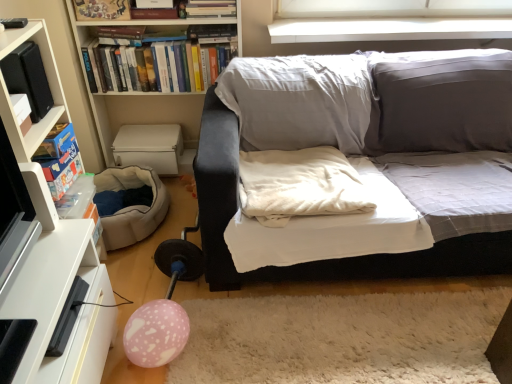
Question: Does white fabric couch at center appear on the left side of matte wooden frame at upper left, which is the 2th book from back to front?

Choices:
 (A) no
 (B) yes

Answer: (A)

Question: From the image's perspective, is white fabric couch at center located above matte wooden frame at upper left, which is the 2th book from back to front?

Choices:
 (A) yes
 (B) no

Answer: (B)

Question: Would you say white fabric couch at center is outside matte wooden frame at upper left, which is the first book in front-to-back order?

Choices:
 (A) yes
 (B) no

Answer: (A)

Question: Is white fabric couch at center oriented away from matte wooden frame at upper left, which is the 2th book from back to front?

Choices:
 (A) no
 (B) yes

Answer: (A)

Question: Does white fabric couch at center have a greater width compared to matte wooden frame at upper left, which is the 2th book from back to front?

Choices:
 (A) yes
 (B) no

Answer: (A)

Question: From a real-world perspective, is black matte speaker at left, the third paperback book in the bottom-to-top sequence, physically located above or below blue cardboard game box at left, marked as the 1th paperback book in a bottom-to-top arrangement?

Choices:
 (A) above
 (B) below

Answer: (A)

Question: Would you say black matte speaker at left, positioned as the first paperback book in top-to-bottom order, is to the left or to the right of blue cardboard game box at left, marked as the 1th paperback book in a bottom-to-top arrangement, in the picture?

Choices:
 (A) left
 (B) right

Answer: (A)

Question: Is black matte speaker at left, the third paperback book in the bottom-to-top sequence, taller or shorter than blue cardboard game box at left, which is the 3th paperback book in top-to-bottom order?

Choices:
 (A) short
 (B) tall

Answer: (B)

Question: Considering their positions, is black matte speaker at left, the third paperback book in the bottom-to-top sequence, located in front of or behind blue cardboard game box at left, which is the 3th paperback book in top-to-bottom order?

Choices:
 (A) front
 (B) behind

Answer: (A)

Question: From the image's perspective, relative to pink matte balloon at lower left, is matte wooden frame at upper left, which is the first book in front-to-back order, above or below?

Choices:
 (A) below
 (B) above

Answer: (B)

Question: Is matte wooden frame at upper left, which is the 2th book from back to front, in front of or behind pink matte balloon at lower left in the image?

Choices:
 (A) front
 (B) behind

Answer: (B)

Question: Is matte wooden frame at upper left, which is the first book in front-to-back order, taller or shorter than pink matte balloon at lower left?

Choices:
 (A) short
 (B) tall

Answer: (A)

Question: Does point (128, 3) appear closer or farther from the camera than point (143, 324)?

Choices:
 (A) farther
 (B) closer

Answer: (A)

Question: Is black matte speaker at left, positioned as the first paperback book in top-to-bottom order, in front of or behind white glossy tv stand at lower left in the image?

Choices:
 (A) front
 (B) behind

Answer: (B)

Question: In terms of height, does black matte speaker at left, the third paperback book in the bottom-to-top sequence, look taller or shorter compared to white glossy tv stand at lower left?

Choices:
 (A) tall
 (B) short

Answer: (B)